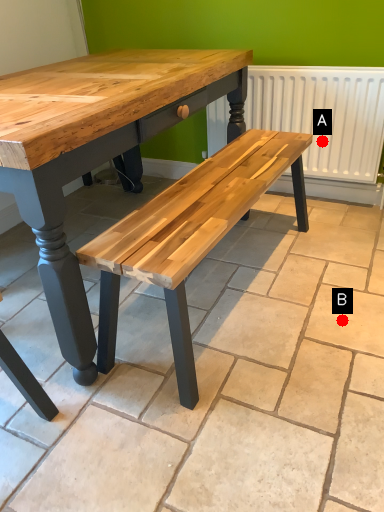
Question: Two points are circled on the image, labeled by A and B beside each circle. Which of the following is the closest to the observer?

Choices:
 (A) A is closer
 (B) B is closer

Answer: (B)